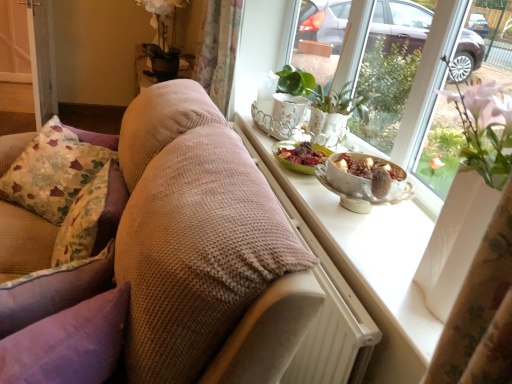
Question: From a real-world perspective, is porcelain bowl with fruit at window sill positioned above or below woven fabric couch at center?

Choices:
 (A) below
 (B) above

Answer: (B)

Question: From the image's perspective, is porcelain bowl with fruit at window sill positioned above or below woven fabric couch at center?

Choices:
 (A) above
 (B) below

Answer: (A)

Question: Considering the real-world distances, which object is farthest from the floral fabric pillow at left, arranged as the first pillow when viewed from the back?

Choices:
 (A) green glossy plant at upper center
 (B) floral fabric curtain at upper center
 (C) purple velvet pillow at left, which ranks as the 3th pillow in back-to-front order
 (D) white glossy window sill at center
 (E) matte white windowsill at upper right

Answer: (E)

Question: Which object is positioned farthest from the green glossy plant at upper center?

Choices:
 (A) floral fabric cushion at left, which ranks as the second pillow in back-to-front order
 (B) woven fabric couch at center
 (C) matte white windowsill at upper right
 (D) purple velvet pillow at left, which ranks as the 3th pillow in back-to-front order
 (E) porcelain bowl with fruit at window sill

Answer: (D)